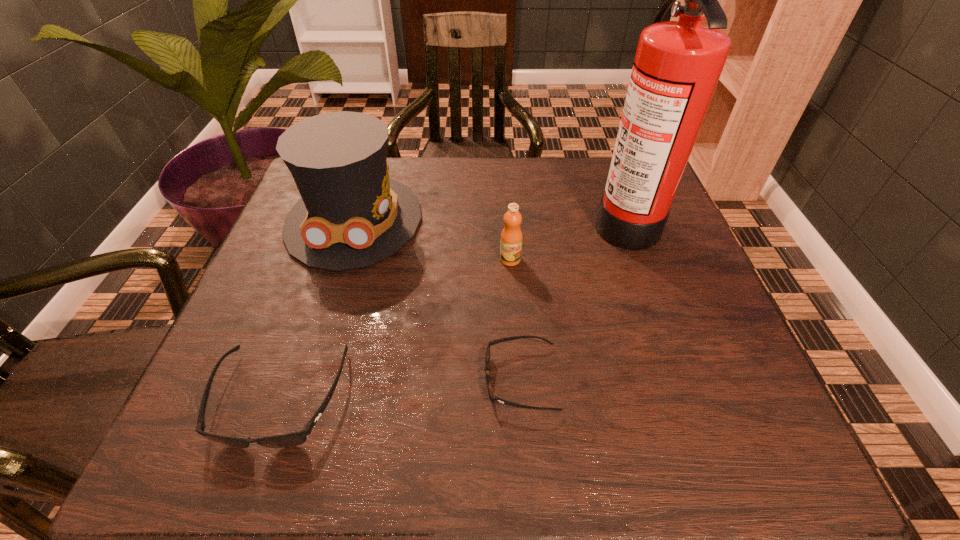
What are the coordinates of `object located at the right edge` in the screenshot? It's located at (677, 66).

Where is `object present at the far left corner`? Image resolution: width=960 pixels, height=540 pixels. object present at the far left corner is located at coordinates (351, 215).

I want to click on object situated at the near left corner, so click(293, 439).

This screenshot has height=540, width=960. I want to click on object at the far right corner, so click(x=677, y=66).

Find the location of a particular element. vacant area at the far edge of the desktop is located at coordinates (481, 182).

In the image, there is a desktop. At what (x,y) coordinates should I click in order to perform the action: click on vacant area at the near edge. Please return your answer as a coordinate pair (x, y). Image resolution: width=960 pixels, height=540 pixels. Looking at the image, I should click on (644, 373).

The image size is (960, 540). I want to click on vacant space at the left edge of the desktop, so click(269, 309).

This screenshot has height=540, width=960. In order to click on vacant space at the right edge of the desktop in this screenshot , I will do `click(666, 328)`.

You are a GUI agent. You are given a task and a screenshot of the screen. Output one action in this format:
    pyautogui.click(x=<x>, y=<y>)
    Task: Click on the free spot at the near right corner of the desktop
    
    Given the screenshot: What is the action you would take?
    pyautogui.click(x=725, y=377)

Locate an element on the screen. empty space that is in between the fire extinguisher and the shortest object is located at coordinates (573, 299).